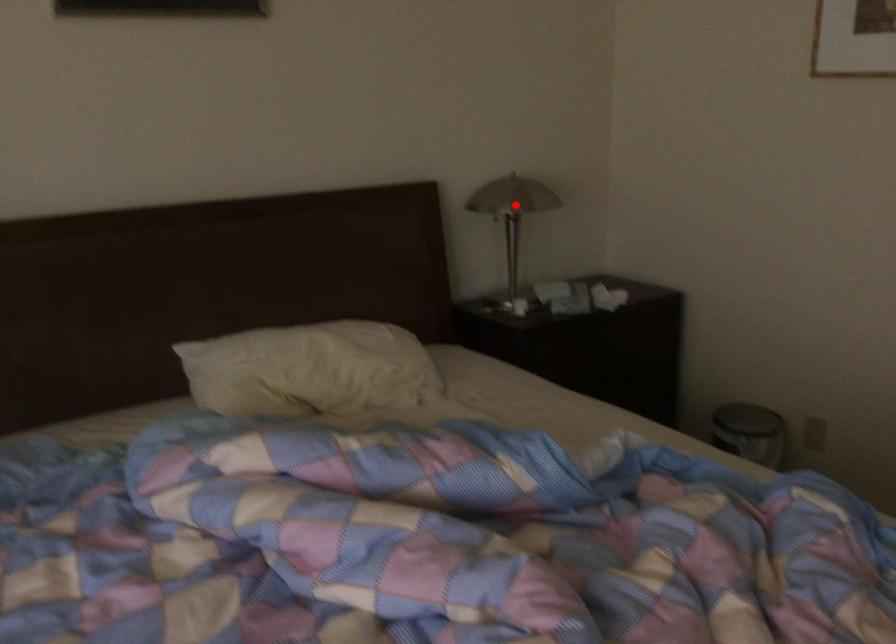
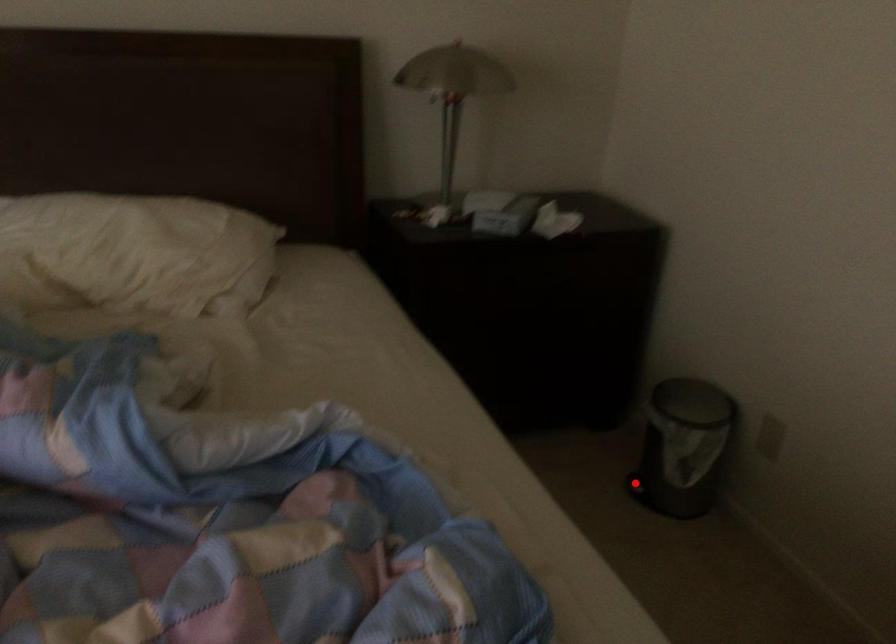
I am providing you with two images of the same scene from different viewpoints. A red point is marked on the first image and another point is marked on the second image. Does the point marked in image1 correspond to the same location as the one in image2?

No